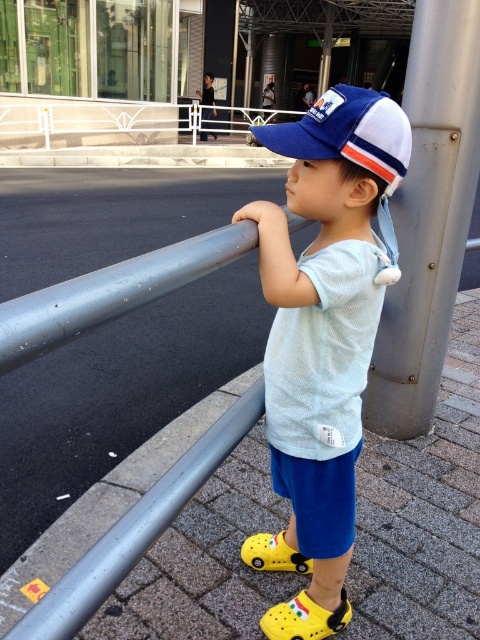
The child is trying to reach the top of the rusty metal pole at right to hang a ribbon. Given that the yellow croc shoe at lower center is the closest object to the ground, how does the height of the pole compare to the shoe?

→ The rusty metal pole at right is taller than the yellow croc shoe at lower center, so the pole is higher than the shoe.

The child is wearing two shoes. Which one of the yellow rubber crocs at lower center or the yellow croc shoe at lower center is wider?

The yellow rubber crocs at lower center is wider than the yellow croc shoe at lower center according to the description.

You are a photographer trying to capture a photo of the rusty metal pole at right and the yellow croc shoe at lower center. Which object should you focus on first to ensure both are in frame without moving the camera?

You should focus on the rusty metal pole at right first because it is closer to the viewer than the yellow croc shoe at lower center, ensuring both are in frame without needing to adjust the camera position.